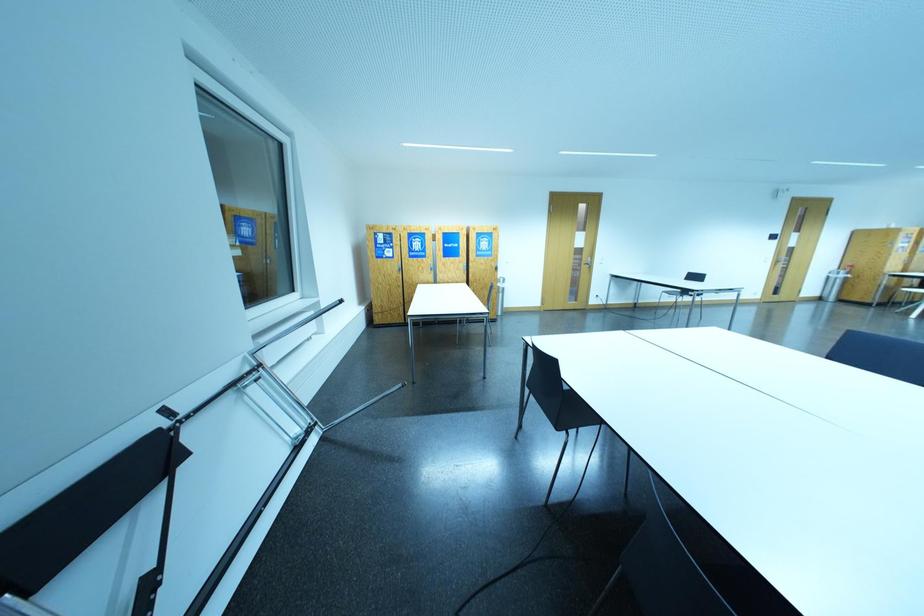
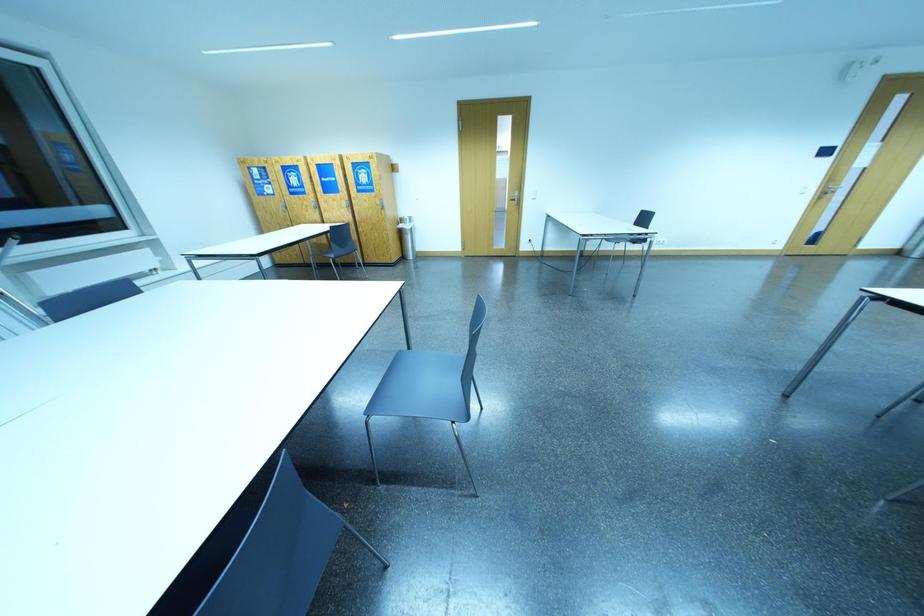
Question: Which direction would the cameraman need to move to produce the second image? Reply with the corresponding letter.

Choices:
 (A) Left
 (B) Right
 (C) Forward
 (D) Backward

Answer: (B)